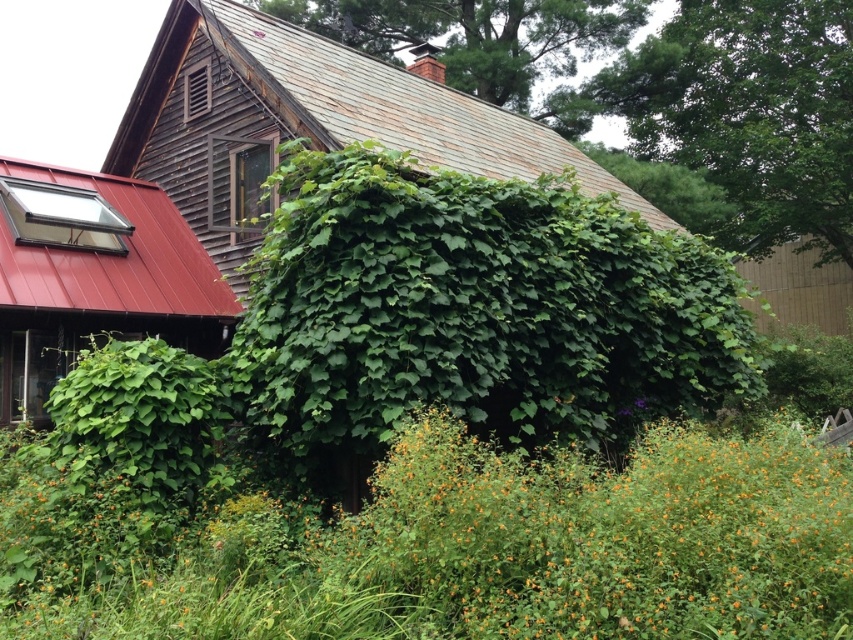
You are standing in front of the rustic wooden house and want to see the green leafy plant at upper center. Is the green leafy bush at center blocking your view of it?

The green leafy bush at center is in front of the green leafy plant at upper center, so it is blocking your view of the plant.